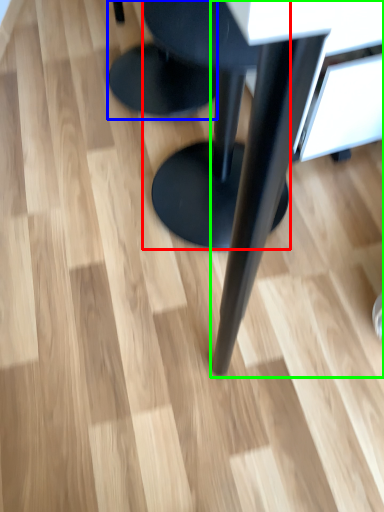
Question: Which is farther away from stool (highlighted by a red box)? stool (highlighted by a blue box) or table (highlighted by a green box)?

Choices:
 (A) stool
 (B) table

Answer: (A)